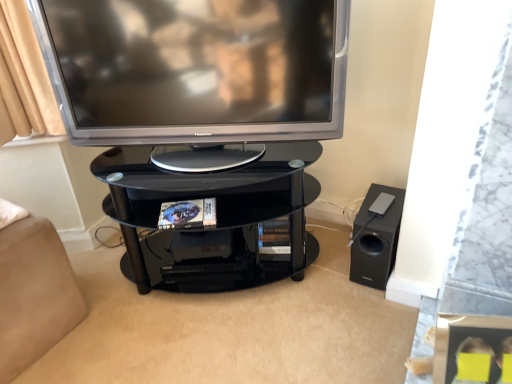
The width and height of the screenshot is (512, 384). In order to click on free space to the back side of black matte speaker at lower right in this screenshot , I will do click(x=332, y=228).